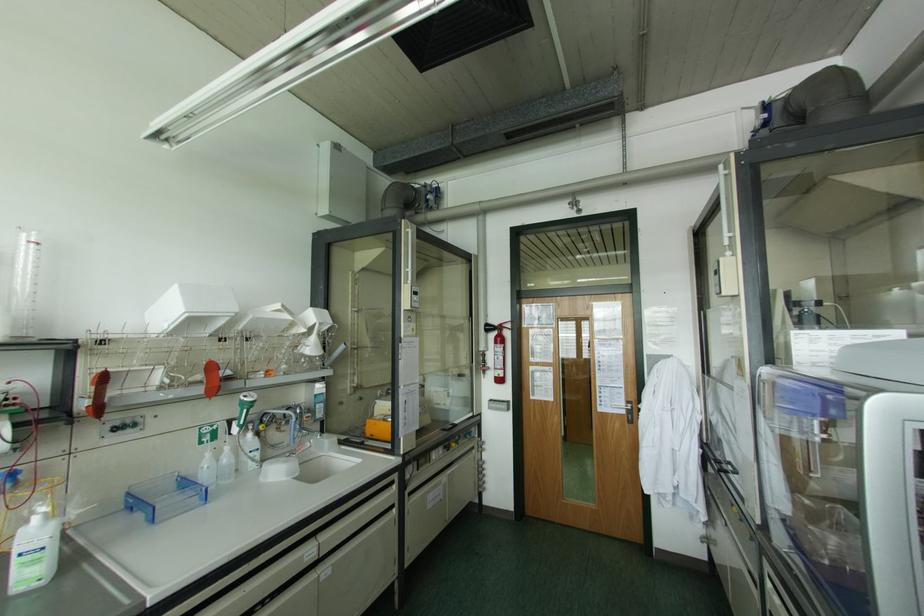
Where would you pull the black vertical handle? Please return your answer as a coordinate pair (x, y).

(366, 498)